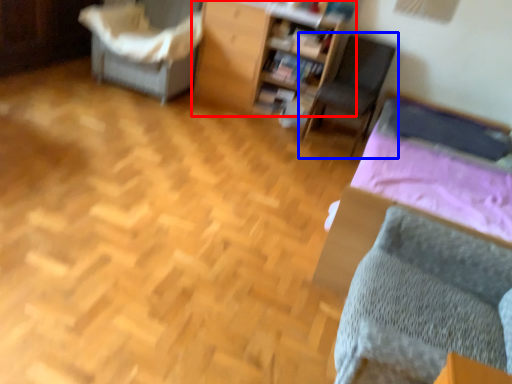
Question: Which point is closer to the camera, furniture (highlighted by a red box) or chair (highlighted by a blue box)?

Choices:
 (A) furniture
 (B) chair

Answer: (B)